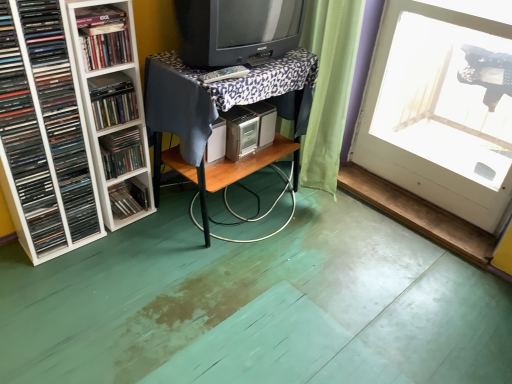
Question: Does wooden table at center, marked as the first table in a bottom-to-top arrangement, have a larger size compared to matte plastic books at left, the second book positioned from the bottom?

Choices:
 (A) no
 (B) yes

Answer: (B)

Question: Is wooden table at center, marked as the first table in a bottom-to-top arrangement, completely or partially outside of matte plastic books at left, which is the fourth book in top-to-bottom order?

Choices:
 (A) no
 (B) yes

Answer: (B)

Question: Is wooden table at center, positioned as the second table in top-to-bottom order, far from matte plastic books at left, the second book positioned from the bottom?

Choices:
 (A) yes
 (B) no

Answer: (B)

Question: From a real-world perspective, is wooden table at center, marked as the first table in a bottom-to-top arrangement, over matte plastic books at left, which is the fourth book in top-to-bottom order?

Choices:
 (A) no
 (B) yes

Answer: (A)

Question: Is wooden table at center, positioned as the second table in top-to-bottom order, beside matte plastic books at left, the second book positioned from the bottom?

Choices:
 (A) yes
 (B) no

Answer: (B)

Question: Could you tell me if wooden table at center, marked as the first table in a bottom-to-top arrangement, is turned towards matte plastic books at left, the second book positioned from the bottom?

Choices:
 (A) no
 (B) yes

Answer: (A)

Question: Is wooden table at center, which is the second table from bottom to top, thinner than white plastic shelf at left, which appears as the 3th book when viewed from the top?

Choices:
 (A) no
 (B) yes

Answer: (A)

Question: Is white plastic shelf at left, the 3th book positioned from the bottom, a part of wooden table at center, which is the second table from bottom to top?

Choices:
 (A) no
 (B) yes

Answer: (A)

Question: Considering the relative sizes of wooden table at center, which is the second table from bottom to top, and white plastic shelf at left, which appears as the 3th book when viewed from the top, in the image provided, is wooden table at center, which is the second table from bottom to top, bigger than white plastic shelf at left, which appears as the 3th book when viewed from the top,?

Choices:
 (A) yes
 (B) no

Answer: (A)

Question: Does wooden table at center, the 1th table viewed from the top, appear on the left side of white plastic shelf at left, which appears as the 3th book when viewed from the top?

Choices:
 (A) no
 (B) yes

Answer: (A)

Question: From the image's perspective, is wooden table at center, the 1th table viewed from the top, below white plastic shelf at left, which appears as the 3th book when viewed from the top?

Choices:
 (A) yes
 (B) no

Answer: (B)

Question: From a real-world perspective, is wooden table at center, the 1th table viewed from the top, located beneath white plastic shelf at left, which appears as the 3th book when viewed from the top?

Choices:
 (A) yes
 (B) no

Answer: (A)

Question: Can wooden table at center, which is the second table from bottom to top, be found inside white plastic shelf at left, the 3th book positioned from the bottom?

Choices:
 (A) yes
 (B) no

Answer: (B)